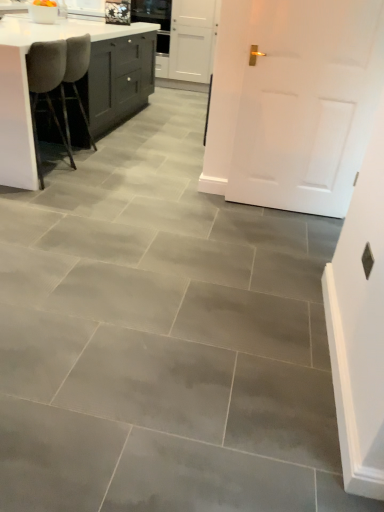
What do you see at coordinates (75, 96) in the screenshot?
I see `gray fabric chair at left, positioned as the second chair in front-to-back order` at bounding box center [75, 96].

This screenshot has width=384, height=512. Identify the location of velvet grey chair at left, the first chair positioned from the front. (46, 85).

From a real-world perspective, is gray fabric chair at left, arranged as the 1th chair when viewed from the back, positioned under white matte door at center based on gravity?

Yes.

Based on the photo, is gray fabric chair at left, arranged as the 1th chair when viewed from the back, turned away from white matte door at center?

Yes, gray fabric chair at left, arranged as the 1th chair when viewed from the back, is positioned with its back facing white matte door at center.

Considering the sizes of gray fabric chair at left, positioned as the second chair in front-to-back order, and white matte door at center in the image, is gray fabric chair at left, positioned as the second chair in front-to-back order, wider or thinner than white matte door at center?

Considering their sizes, gray fabric chair at left, positioned as the second chair in front-to-back order, looks broader than white matte door at center.

Considering the relative sizes of white glossy countertop at upper left and gray fabric chair at left, arranged as the 1th chair when viewed from the back, in the image provided, is white glossy countertop at upper left taller than gray fabric chair at left, arranged as the 1th chair when viewed from the back,?

In fact, white glossy countertop at upper left may be shorter than gray fabric chair at left, arranged as the 1th chair when viewed from the back.

From the image's perspective, is white glossy countertop at upper left located beneath gray fabric chair at left, positioned as the second chair in front-to-back order?

No.

Is white glossy countertop at upper left positioned behind gray fabric chair at left, arranged as the 1th chair when viewed from the back?

No, white glossy countertop at upper left is closer to the camera.

Considering the positions of points (27, 121) and (57, 87), is point (27, 121) farther from camera compared to point (57, 87)?

No.

Is velvet grey chair at left, the first chair positioned from the front, turned away from white matte door at center?

Yes.

Consider the image. Looking at the image, does velvet grey chair at left, the first chair positioned from the front, seem bigger or smaller compared to white matte door at center?

In the image, velvet grey chair at left, the first chair positioned from the front, appears to be larger than white matte door at center.

Who is taller, velvet grey chair at left, the second chair from the back, or white matte door at center?

white matte door at center.

How much distance is there between velvet grey chair at left, the second chair from the back, and white matte door at center?

5.34 feet.

Is gray fabric chair at left, arranged as the 1th chair when viewed from the back, facing towards white glossy countertop at upper left?

Yes, gray fabric chair at left, arranged as the 1th chair when viewed from the back, is oriented towards white glossy countertop at upper left.

Is gray fabric chair at left, positioned as the second chair in front-to-back order, surrounding white glossy countertop at upper left?

No, white glossy countertop at upper left is not inside gray fabric chair at left, positioned as the second chair in front-to-back order.

Does gray fabric chair at left, positioned as the second chair in front-to-back order, have a greater height compared to white glossy countertop at upper left?

Yes.

From the image's perspective, which is below, gray fabric chair at left, positioned as the second chair in front-to-back order, or white glossy countertop at upper left?

gray fabric chair at left, positioned as the second chair in front-to-back order, is shown below in the image.

Is point (46, 39) more distant than point (363, 87)?

That is True.

Is white glossy countertop at upper left oriented towards white matte door at center?

No, white glossy countertop at upper left is not oriented towards white matte door at center.

Is white glossy countertop at upper left at the right side of white matte door at center?

Incorrect, white glossy countertop at upper left is not on the right side of white matte door at center.

Does velvet grey chair at left, the second chair from the back, turn towards gray fabric chair at left, positioned as the second chair in front-to-back order?

No, velvet grey chair at left, the second chair from the back, is not facing towards gray fabric chair at left, positioned as the second chair in front-to-back order.

Considering the sizes of objects velvet grey chair at left, the first chair positioned from the front, and gray fabric chair at left, arranged as the 1th chair when viewed from the back, in the image provided, who is taller, velvet grey chair at left, the first chair positioned from the front, or gray fabric chair at left, arranged as the 1th chair when viewed from the back,?

gray fabric chair at left, arranged as the 1th chair when viewed from the back, is taller.

Is velvet grey chair at left, the second chair from the back, directly adjacent to gray fabric chair at left, positioned as the second chair in front-to-back order?

velvet grey chair at left, the second chair from the back, and gray fabric chair at left, positioned as the second chair in front-to-back order, are not in contact.

From the image's perspective, is velvet grey chair at left, the second chair from the back, below gray fabric chair at left, arranged as the 1th chair when viewed from the back?

Yes.

From their relative heights in the image, would you say white matte door at center is taller or shorter than gray fabric chair at left, arranged as the 1th chair when viewed from the back?

Clearly, white matte door at center is taller compared to gray fabric chair at left, arranged as the 1th chair when viewed from the back.

Locate an element on the screen. door in front of the gray fabric chair at left, positioned as the second chair in front-to-back order is located at coordinates (307, 103).

Can you tell me how much white matte door at center and gray fabric chair at left, positioned as the second chair in front-to-back order, differ in facing direction?

The facing directions of white matte door at center and gray fabric chair at left, positioned as the second chair in front-to-back order, are 92.4 degrees apart.

Is white matte door at center not within gray fabric chair at left, positioned as the second chair in front-to-back order?

Yes.

This screenshot has width=384, height=512. Identify the location of door that appears on the right of gray fabric chair at left, positioned as the second chair in front-to-back order. (307, 103).

Locate an element on the screen. The height and width of the screenshot is (512, 384). countertop in front of the gray fabric chair at left, positioned as the second chair in front-to-back order is located at coordinates (28, 89).

Based on their spatial positions, is velvet grey chair at left, the first chair positioned from the front, or white matte door at center further from gray fabric chair at left, arranged as the 1th chair when viewed from the back?

white matte door at center is positioned further to the anchor gray fabric chair at left, arranged as the 1th chair when viewed from the back.

Considering their positions, is white matte door at center positioned closer to white glossy countertop at upper left than velvet grey chair at left, the first chair positioned from the front?

velvet grey chair at left, the first chair positioned from the front, is positioned closer to the anchor white glossy countertop at upper left.

When comparing their distances from white matte door at center, does white glossy countertop at upper left or gray fabric chair at left, positioned as the second chair in front-to-back order, seem further?

Among the two, gray fabric chair at left, positioned as the second chair in front-to-back order, is located further to white matte door at center.

Based on their spatial positions, is white matte door at center or white glossy countertop at upper left closer to gray fabric chair at left, arranged as the 1th chair when viewed from the back?

white glossy countertop at upper left.

When comparing their distances from velvet grey chair at left, the second chair from the back, does gray fabric chair at left, arranged as the 1th chair when viewed from the back, or white matte door at center seem further?

white matte door at center lies further to velvet grey chair at left, the second chair from the back, than the other object.

Considering their positions, is white matte door at center positioned further to white glossy countertop at upper left than gray fabric chair at left, positioned as the second chair in front-to-back order?

The object further to white glossy countertop at upper left is white matte door at center.

From the image, which object appears to be nearer to gray fabric chair at left, positioned as the second chair in front-to-back order, white glossy countertop at upper left or white matte door at center?

white glossy countertop at upper left is positioned closer to the anchor gray fabric chair at left, positioned as the second chair in front-to-back order.

From the image, which object appears to be nearer to white glossy countertop at upper left, velvet grey chair at left, the second chair from the back, or white matte door at center?

velvet grey chair at left, the second chair from the back.

Locate an element on the screen. chair that lies between white glossy countertop at upper left and velvet grey chair at left, the second chair from the back, from top to bottom is located at coordinates (75, 96).

Identify the location of chair located between velvet grey chair at left, the first chair positioned from the front, and white matte door at center in the left-right direction. This screenshot has width=384, height=512. (75, 96).